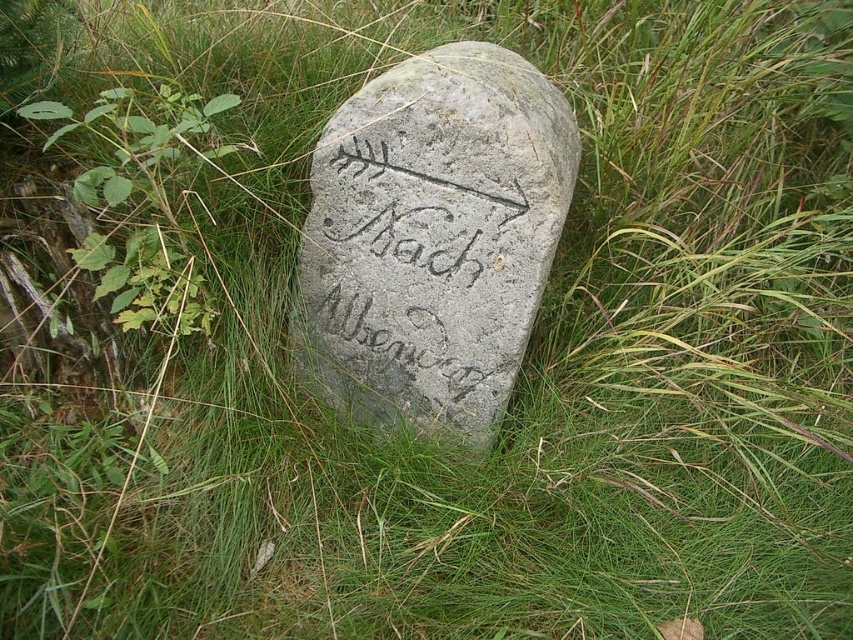
You are standing in a grassy area near a weathered stone marker with an inscription and arrow pointing to the right. The marker has coordinates at point (341, 369). If you want to reach the destination indicated by the arrow, which direction should you walk relative to the marker?

The arrow on the stone marker points to the right, so you should walk in the direction the arrow is pointing, which is to the right of the marker.

You are standing in a grassy field and see the gray stone marker at center and the green leafy plant at left. Which object is closer to you?

The gray stone marker at center is closer to you because it is further to the viewer than the green leafy plant at left.

You are a hiker with a 16 inch wide backpack. You want to walk past the gray stone marker at center and the green leafy plant at left. Can you pass through the space between them without moving either object?

The gray stone marker at center and green leafy plant at left are 17.45 inches apart. Since your backpack is 16 inches wide, you can pass through the space between them without moving either object because the distance is wider than your backpack.